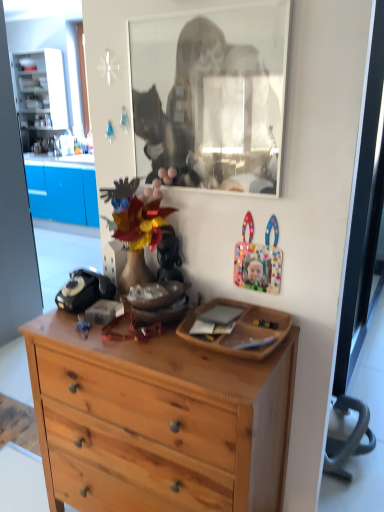
Locate an element on the screen. Image resolution: width=384 pixels, height=512 pixels. vacant space to the left of matte plastic mask at center is located at coordinates (104, 308).